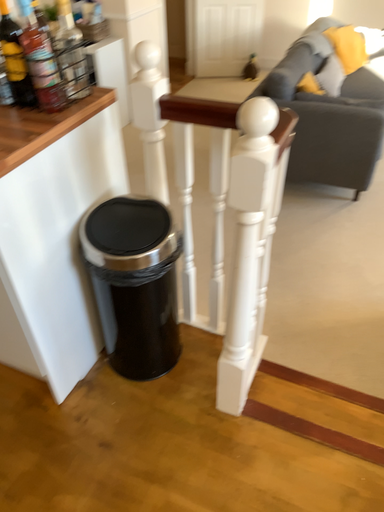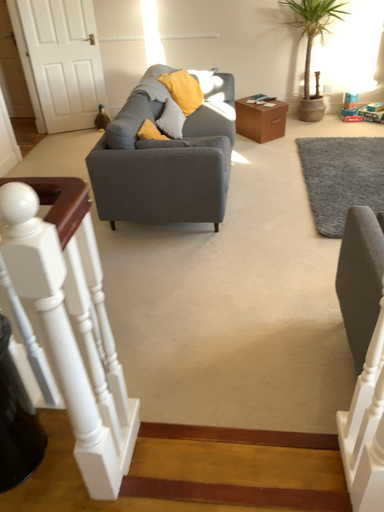
Question: Which way did the camera rotate in the video?

Choices:
 (A) rotated right
 (B) rotated left

Answer: (A)